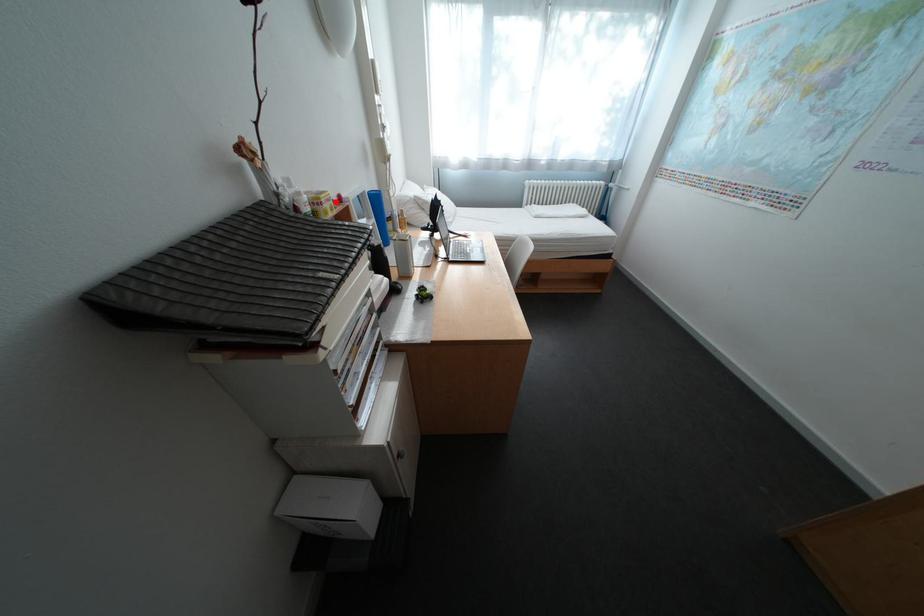
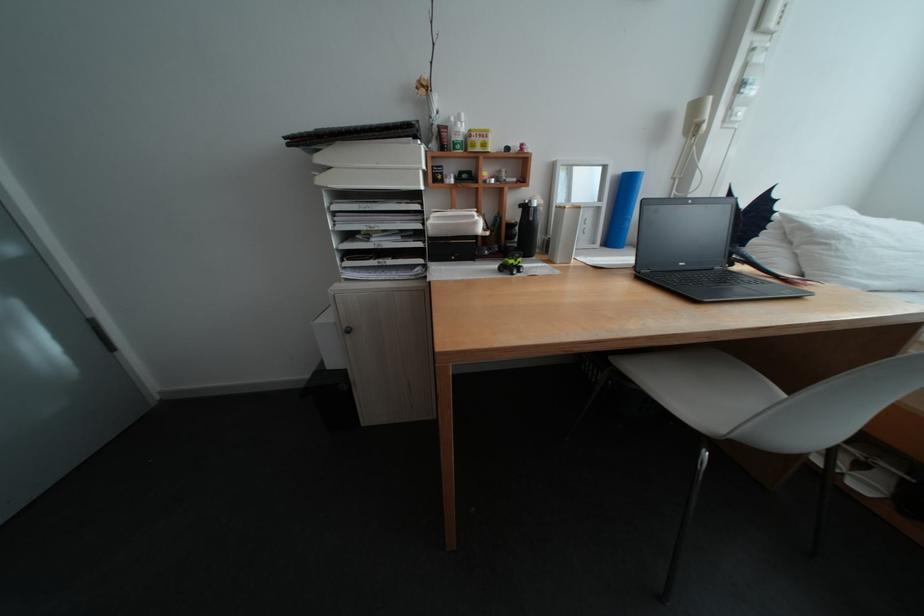
Locate, in the second image, the point that corresponds to the highlighted location in the first image.

(485, 135)